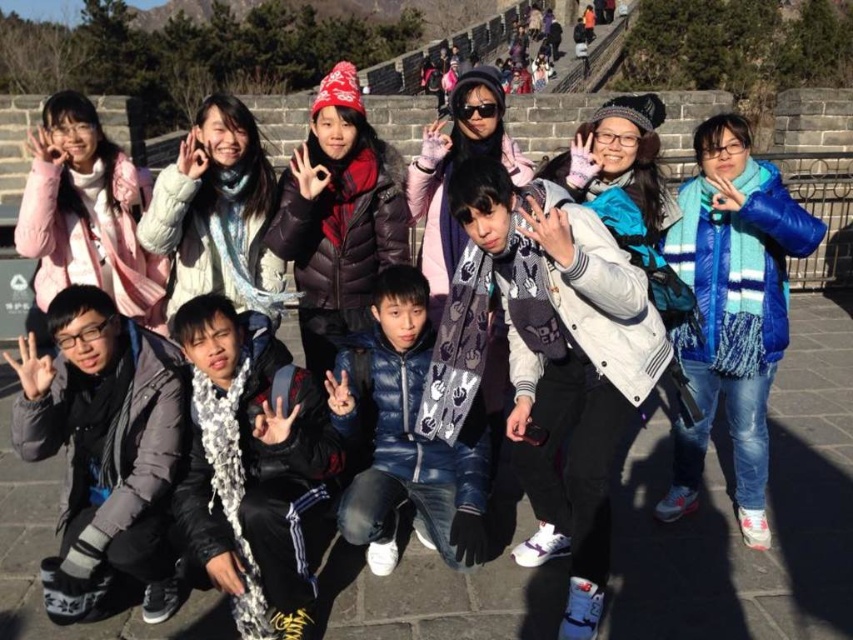
Question: Which point is farther from the camera taking this photo?

Choices:
 (A) (424, 499)
 (B) (578, 481)
 (C) (170, 204)
 (D) (126, 243)

Answer: (D)

Question: Which of the following is the farthest from the observer?

Choices:
 (A) white textured scarf at center
 (B) blue down jacket at center
 (C) gray woolen sweater at lower left
 (D) white matte jacket at center

Answer: (D)

Question: Can you confirm if white fleece jacket at center is bigger than blue down jacket at center?

Choices:
 (A) yes
 (B) no

Answer: (A)

Question: Does white fleece jacket at center have a smaller size compared to gray woolen sweater at lower left?

Choices:
 (A) no
 (B) yes

Answer: (A)

Question: Among these objects, which one is farthest from the camera?

Choices:
 (A) blue down jacket at center
 (B) white textured scarf at center

Answer: (A)

Question: Is blue quilted jacket at center below blue down jacket at center?

Choices:
 (A) no
 (B) yes

Answer: (A)